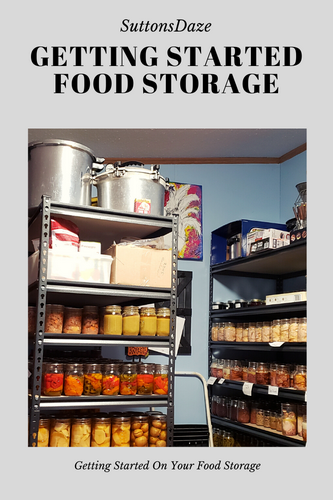
Identify the location of large round pots. The image size is (333, 500). [x=60, y=179], [x=136, y=193].